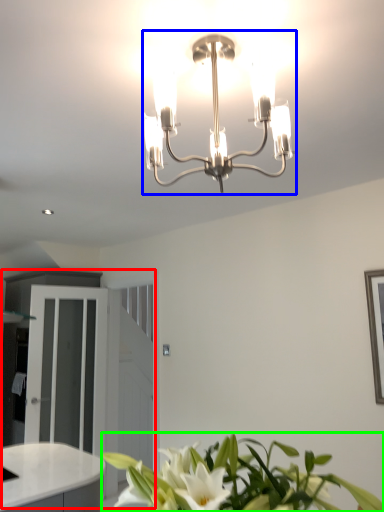
Question: Which is nearer to the dresser (highlighted by a red box)? lamp (highlighted by a blue box) or houseplant (highlighted by a green box).

Choices:
 (A) lamp
 (B) houseplant

Answer: (B)